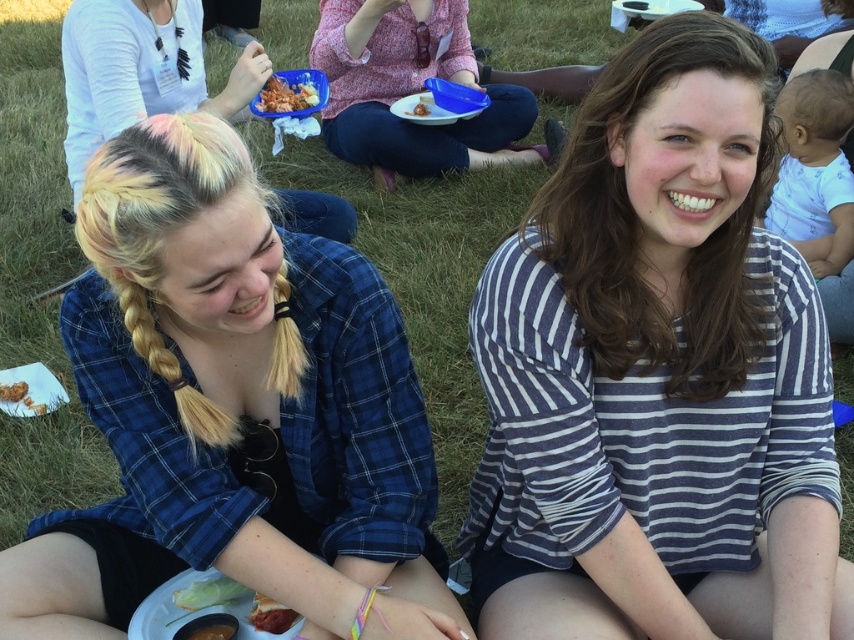
Is point (413, 536) farther from viewer compared to point (472, 93)?

No, (413, 536) is closer to viewer.

Who is lower down, blue plaid shirt at left or white plastic plate at center?

Positioned lower is blue plaid shirt at left.

Describe the element at coordinates (234, 404) in the screenshot. I see `blue plaid shirt at left` at that location.

Image resolution: width=854 pixels, height=640 pixels. Find the location of `blue plaid shirt at left`. blue plaid shirt at left is located at coordinates (234, 404).

Can you confirm if white plastic plate at center is shorter than shiny plastic container at upper center?

Yes.

Based on the photo, does white plastic plate at center appear over shiny plastic container at upper center?

Yes.

Does point (408, 97) come farther from viewer compared to point (308, 90)?

That is True.

The image size is (854, 640). I want to click on white plastic plate at center, so click(x=439, y=106).

Can you confirm if green leafy lettuce at lower left is positioned above shiny red sauce at lower left?

Indeed, green leafy lettuce at lower left is positioned over shiny red sauce at lower left.

Is point (212, 602) less distant than point (259, 616)?

No, (212, 602) is behind (259, 616).

Find the location of a particular element. This screenshot has height=640, width=854. green leafy lettuce at lower left is located at coordinates (209, 593).